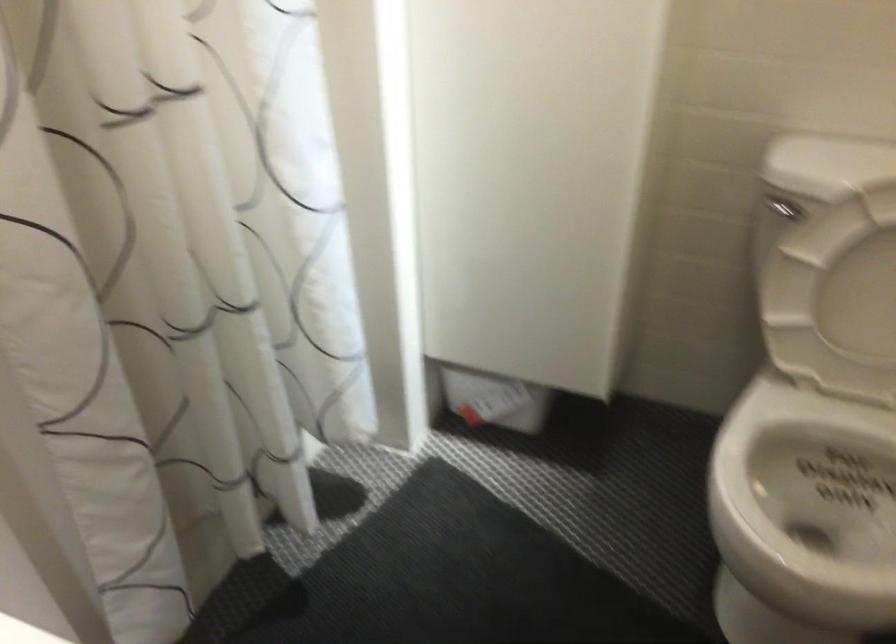
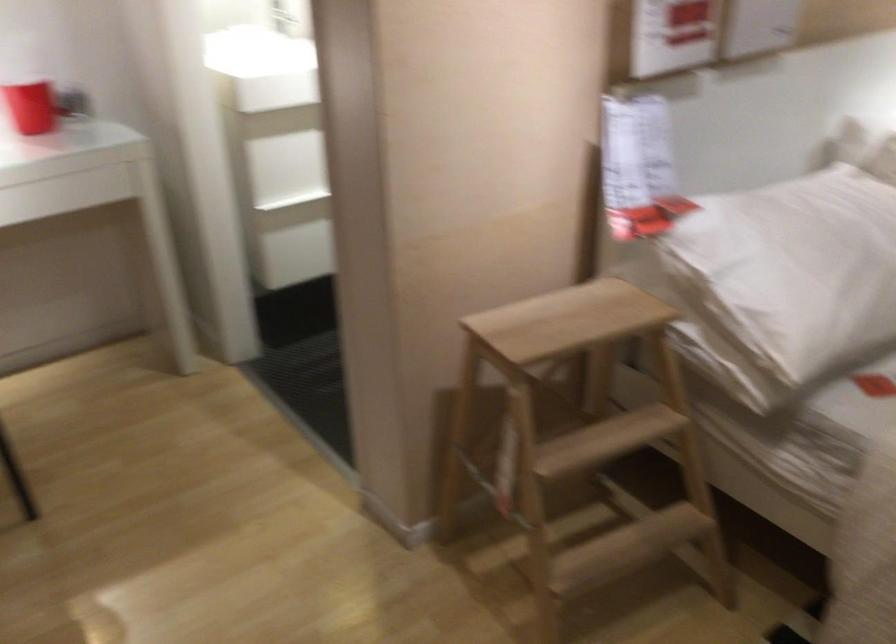
Question: I am providing you with two images of the same scene from different viewpoints. Which of the following objects are not visible in image2?

Choices:
 (A) black dishwasher handle
 (B) red cup
 (C) toilet flush lever
 (D) white pillow

Answer: (C)